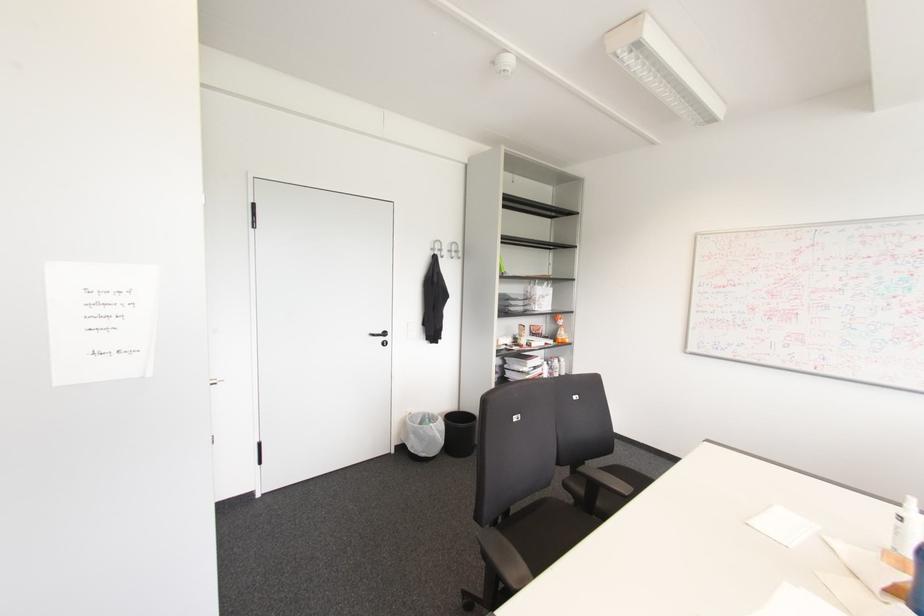
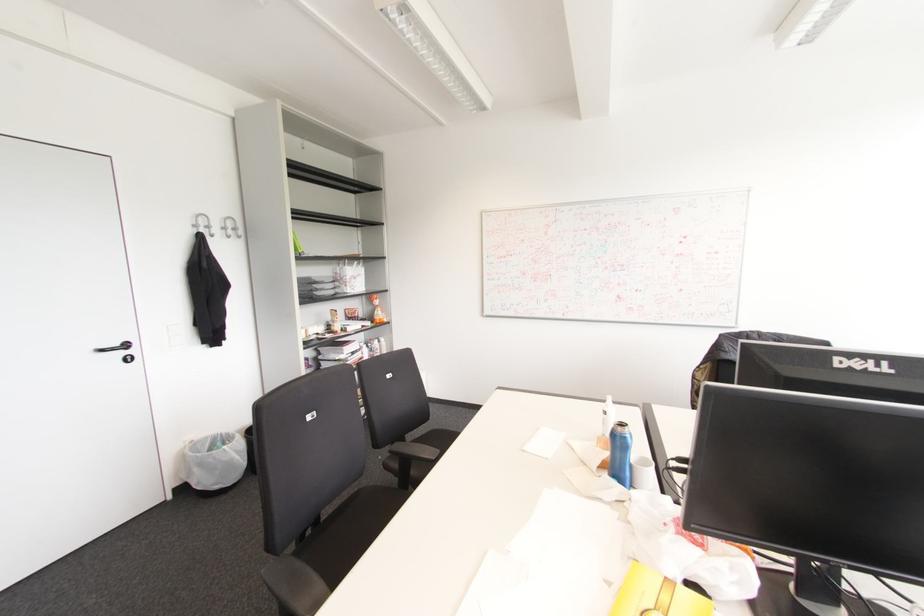
Find the pixel in the second image that matches (505,541) in the first image.

(298, 564)